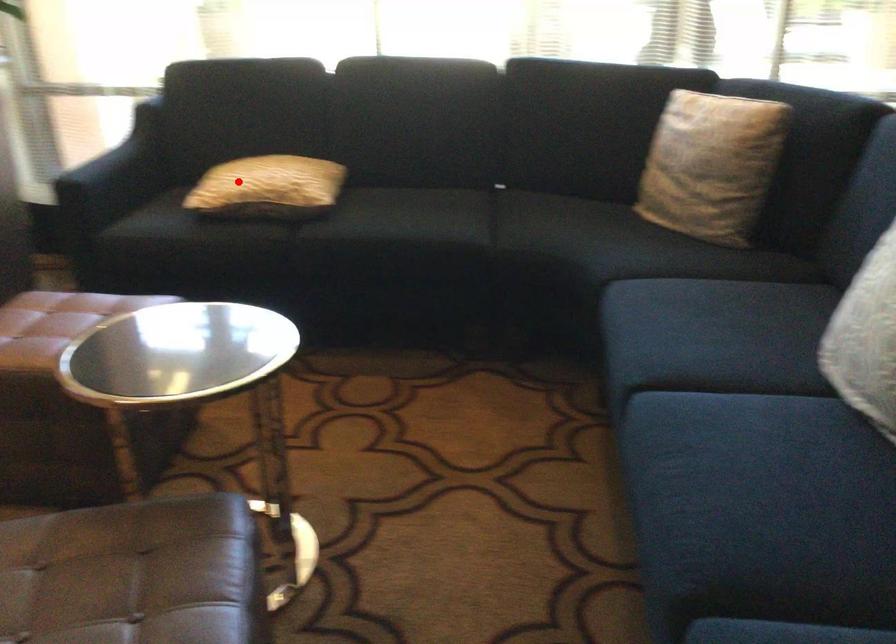
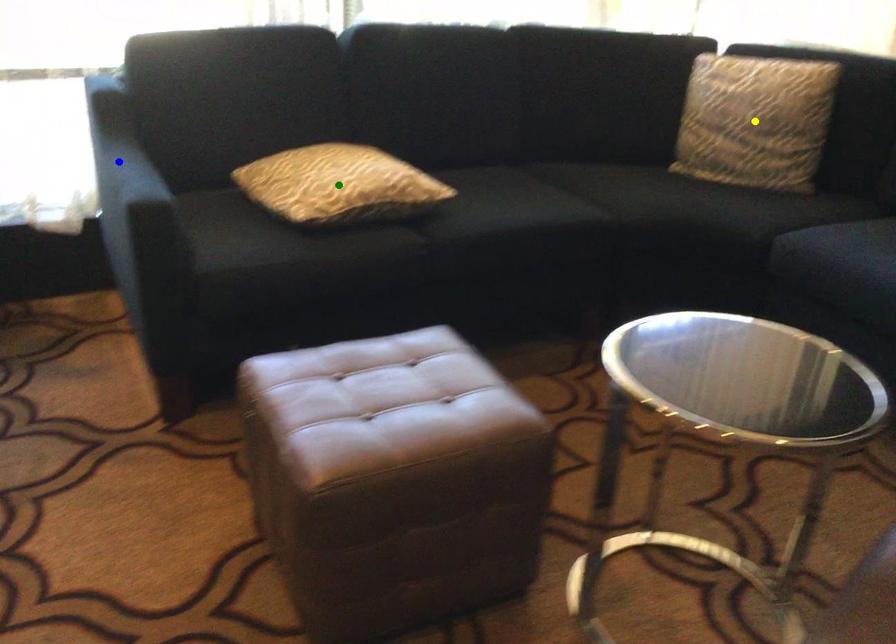
Question: I am providing you with two images of the same scene from different viewpoints. A red point is marked on the first image. You are given multiple points on the second image. Which mark in image 2 goes with the point in image 1?

Choices:
 (A) yellow point
 (B) blue point
 (C) green point

Answer: (C)